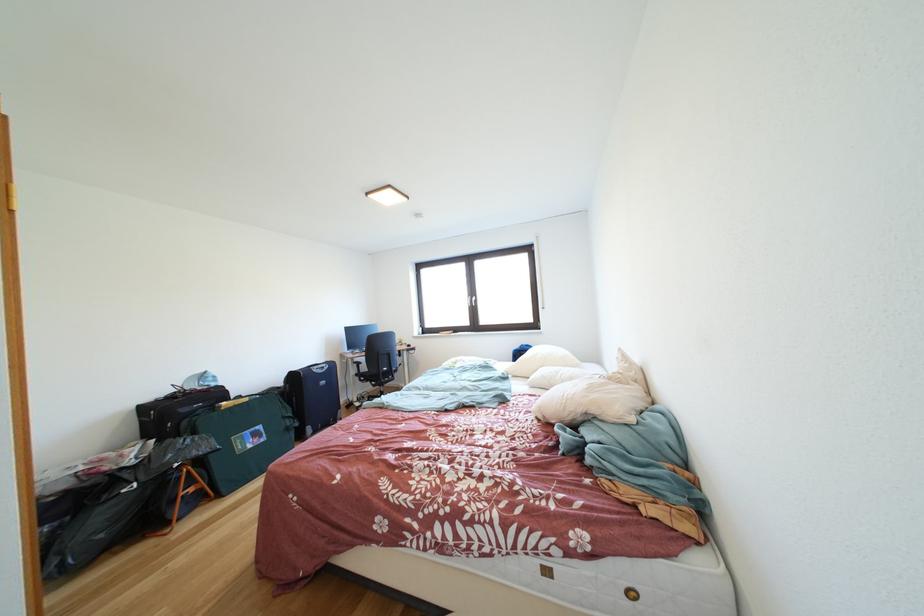
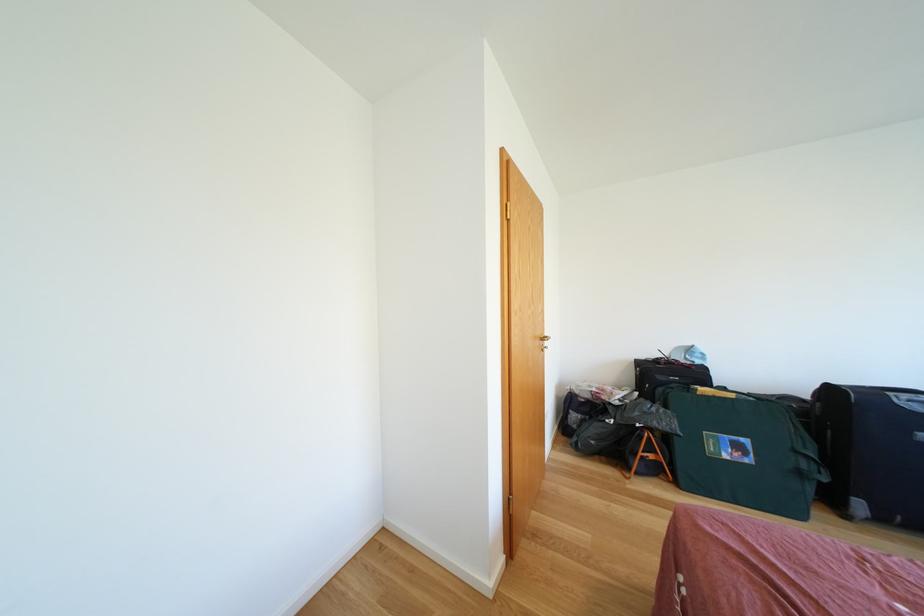
Question: The camera is either moving clockwise (left) or counter-clockwise (right) around the object. The first image is from the beginning of the video and the second image is from the end. Is the camera moving left or right when shooting the video?

Choices:
 (A) Left
 (B) Right

Answer: (B)